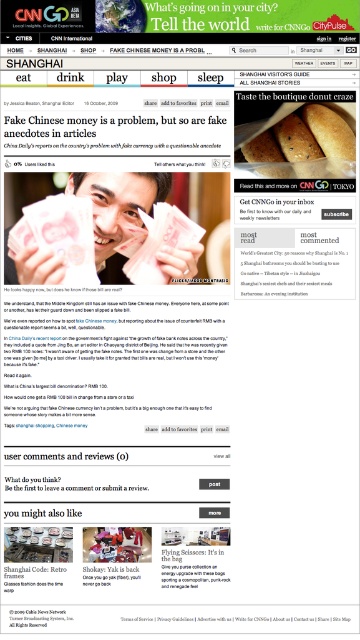
Based on the photo, is the position of brown crumbly donut at upper right more distant than that of matte brown donut at center?

Yes, brown crumbly donut at upper right is further from the viewer.

In the scene shown: Between brown crumbly donut at upper right and matte brown donut at center, which one has less height?

Standing shorter between the two is matte brown donut at center.

Is point (336, 113) positioned before point (142, 531)?

No.

The image size is (360, 640). Identify the location of brown crumbly donut at upper right. (302, 141).